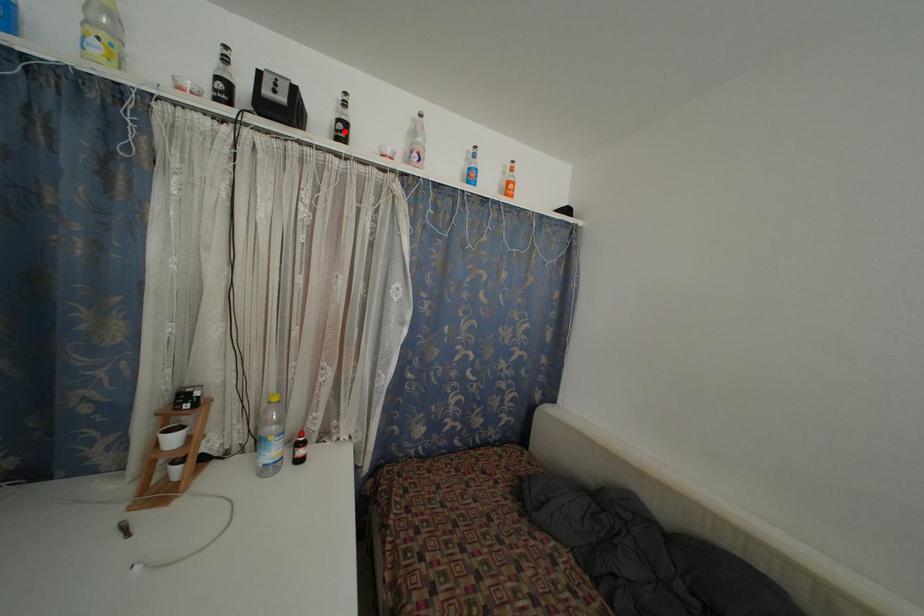
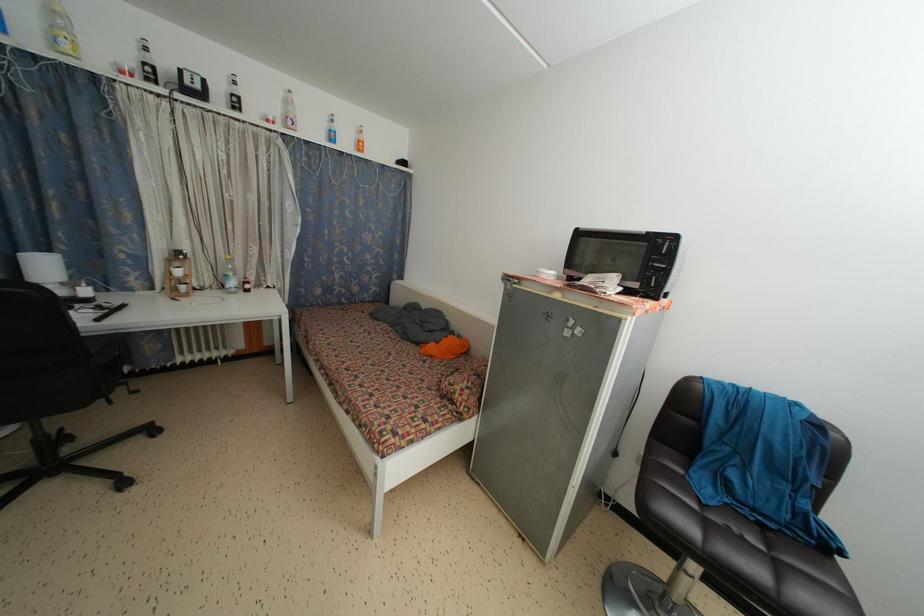
The point at the highlighted location is marked in the first image. Where is the corresponding point in the second image?

(238, 105)